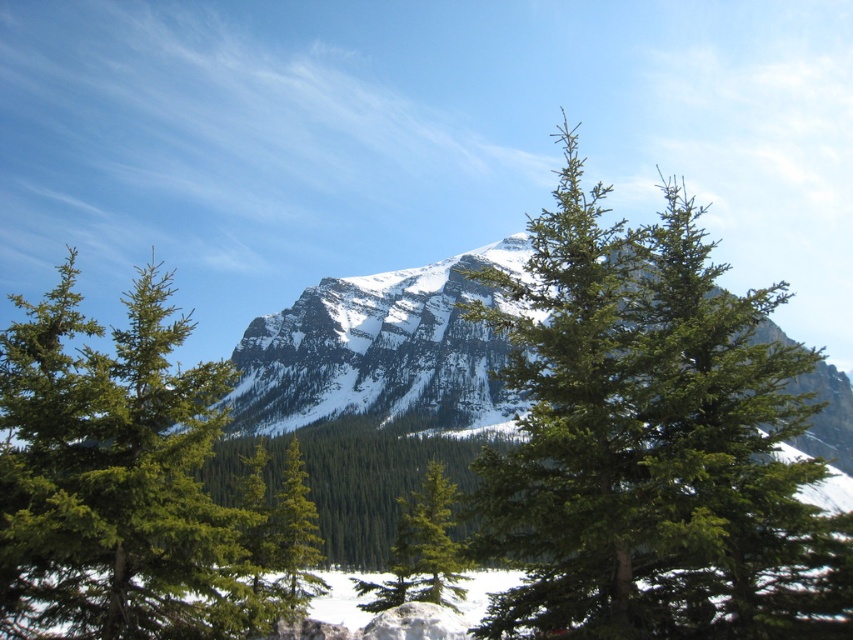
Which is above, green needle-like at center or snowy granite mountain at center?

green needle-like at center is above.

Does green needle-like at center have a smaller size compared to snowy granite mountain at center?

Actually, green needle-like at center might be larger than snowy granite mountain at center.

Does point (119, 572) come closer to viewer compared to point (440, 364)?

Yes, it is.

The image size is (853, 640). I want to click on green needle-like at center, so click(x=119, y=481).

Where is `green needle-like at center`? green needle-like at center is located at coordinates (119, 481).

Looking at this image, can you confirm if snowy granite mountain at center is wider than green matte tree at center?

Indeed, snowy granite mountain at center has a greater width compared to green matte tree at center.

This screenshot has height=640, width=853. Describe the element at coordinates (378, 353) in the screenshot. I see `snowy granite mountain at center` at that location.

Between point (294, 417) and point (428, 504), which one is positioned in front?

Point (428, 504) is more forward.

Where is `snowy granite mountain at center`? This screenshot has width=853, height=640. snowy granite mountain at center is located at coordinates (378, 353).